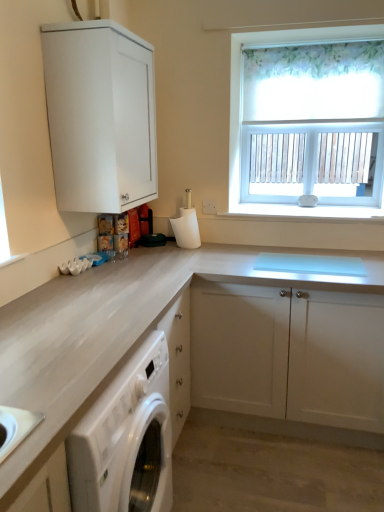
Question: Can you see white matte cabinet at center, positioned as the 2th cabinetry in top-to-bottom order, touching white matte cabinet at upper left, marked as the 1th cabinetry in a top-to-bottom arrangement?

Choices:
 (A) no
 (B) yes

Answer: (A)

Question: From a real-world perspective, does white matte cabinet at center, the 1th cabinetry from the bottom, stand above white matte cabinet at upper left, marked as the 1th cabinetry in a top-to-bottom arrangement?

Choices:
 (A) no
 (B) yes

Answer: (A)

Question: Does white matte cabinet at center, positioned as the 2th cabinetry in top-to-bottom order, come in front of white matte cabinet at upper left, marked as the 1th cabinetry in a top-to-bottom arrangement?

Choices:
 (A) yes
 (B) no

Answer: (B)

Question: Considering the relative positions of white matte cabinet at center, positioned as the 2th cabinetry in top-to-bottom order, and white matte cabinet at upper left, placed as the second cabinetry when sorted from bottom to top, in the image provided, is white matte cabinet at center, positioned as the 2th cabinetry in top-to-bottom order, to the right of white matte cabinet at upper left, placed as the second cabinetry when sorted from bottom to top, from the viewer's perspective?

Choices:
 (A) yes
 (B) no

Answer: (A)

Question: From the image's perspective, does white matte cabinet at center, positioned as the 2th cabinetry in top-to-bottom order, appear lower than white matte cabinet at upper left, placed as the second cabinetry when sorted from bottom to top?

Choices:
 (A) no
 (B) yes

Answer: (B)

Question: Can you confirm if white matte cabinet at center, the 1th cabinetry from the bottom, is thinner than white matte cabinet at upper left, placed as the second cabinetry when sorted from bottom to top?

Choices:
 (A) yes
 (B) no

Answer: (B)

Question: Considering the relative sizes of white glossy washing machine at lower left and white matte cabinet at center, the 1th cabinetry from the bottom, in the image provided, is white glossy washing machine at lower left wider than white matte cabinet at center, the 1th cabinetry from the bottom,?

Choices:
 (A) yes
 (B) no

Answer: (B)

Question: Is white glossy washing machine at lower left turned away from white matte cabinet at center, the 1th cabinetry from the bottom?

Choices:
 (A) no
 (B) yes

Answer: (A)

Question: Is white glossy washing machine at lower left further to camera compared to white matte cabinet at center, the 1th cabinetry from the bottom?

Choices:
 (A) yes
 (B) no

Answer: (B)

Question: Is white glossy washing machine at lower left touching white matte cabinet at center, the 1th cabinetry from the bottom?

Choices:
 (A) yes
 (B) no

Answer: (B)

Question: Can you confirm if white glossy washing machine at lower left is positioned to the right of white matte cabinet at center, the 1th cabinetry from the bottom?

Choices:
 (A) no
 (B) yes

Answer: (A)

Question: Can you confirm if white glossy washing machine at lower left is smaller than white matte cabinet at center, the 1th cabinetry from the bottom?

Choices:
 (A) yes
 (B) no

Answer: (A)

Question: From a real-world perspective, is white matte cabinet at upper left, marked as the 1th cabinetry in a top-to-bottom arrangement, under white floral roller blind at upper right?

Choices:
 (A) yes
 (B) no

Answer: (B)